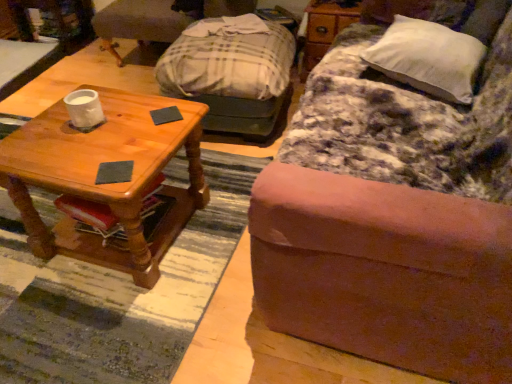
The height and width of the screenshot is (384, 512). Find the location of `free location in front of dark gray matte coaster at center, acting as the 1th pad starting from the top`. free location in front of dark gray matte coaster at center, acting as the 1th pad starting from the top is located at coordinates (148, 139).